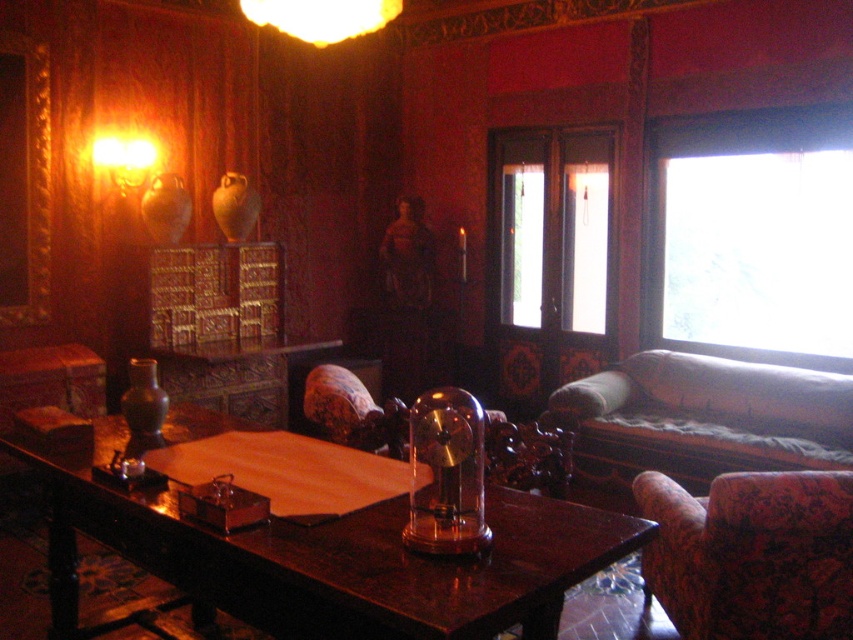
Question: Which point is closer to the camera?

Choices:
 (A) matte gold lampshade at upper center
 (B) matte glass lamp at upper left
 (C) velvet beige couch at right
 (D) shiny dark wood table at center

Answer: (D)

Question: Which object is farther from the camera taking this photo?

Choices:
 (A) matte glass lamp at upper left
 (B) matte gold lampshade at upper center
 (C) velvet beige couch at right

Answer: (A)

Question: Which of the following is the closest to the observer?

Choices:
 (A) (553, 499)
 (B) (106, 147)

Answer: (A)

Question: In this image, where is floral fabric armchair at lower right located relative to matte glass lamp at upper left?

Choices:
 (A) above
 (B) below

Answer: (B)

Question: Is shiny dark wood table at center closer to the viewer compared to floral fabric armchair at lower right?

Choices:
 (A) no
 (B) yes

Answer: (B)

Question: Does velvet beige couch at right have a larger size compared to matte glass lamp at upper left?

Choices:
 (A) yes
 (B) no

Answer: (A)